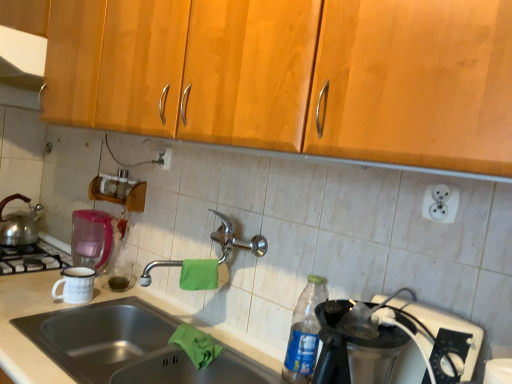
Question: Would you say stainless steel sink at lower left is a long distance from green cloth at sink, the first material positioned from the bottom?

Choices:
 (A) yes
 (B) no

Answer: (B)

Question: Is stainless steel sink at lower left positioned behind green cloth at sink, the first material positioned from the bottom?

Choices:
 (A) no
 (B) yes

Answer: (A)

Question: From the image's perspective, is stainless steel sink at lower left above green cloth at sink, the first material positioned from the bottom?

Choices:
 (A) no
 (B) yes

Answer: (A)

Question: Considering the relative sizes of stainless steel sink at lower left and green cloth at sink, the first material positioned from the bottom, in the image provided, is stainless steel sink at lower left shorter than green cloth at sink, the first material positioned from the bottom,?

Choices:
 (A) yes
 (B) no

Answer: (B)

Question: From a real-world perspective, is stainless steel sink at lower left physically below green cloth at sink, which ranks as the second material in top-to-bottom order?

Choices:
 (A) yes
 (B) no

Answer: (A)

Question: Is stainless steel sink at lower left positioned before green cloth at sink, which ranks as the second material in top-to-bottom order?

Choices:
 (A) yes
 (B) no

Answer: (A)

Question: Is green cloth at center, acting as the 1th material starting from the top, oriented towards shiny silver tea pot at left?

Choices:
 (A) yes
 (B) no

Answer: (B)

Question: From a real-world perspective, is green cloth at center, acting as the 2th material starting from the bottom, located higher than shiny silver tea pot at left?

Choices:
 (A) no
 (B) yes

Answer: (B)

Question: Is green cloth at center, acting as the 1th material starting from the top, positioned in front of shiny silver tea pot at left?

Choices:
 (A) no
 (B) yes

Answer: (B)

Question: Is green cloth at center, acting as the 2th material starting from the bottom, at the right side of shiny silver tea pot at left?

Choices:
 (A) no
 (B) yes

Answer: (B)

Question: Is the depth of green cloth at center, acting as the 2th material starting from the bottom, greater than that of shiny silver tea pot at left?

Choices:
 (A) no
 (B) yes

Answer: (A)

Question: Considering the relative sizes of green cloth at center, acting as the 2th material starting from the bottom, and shiny silver tea pot at left in the image provided, is green cloth at center, acting as the 2th material starting from the bottom, wider than shiny silver tea pot at left?

Choices:
 (A) yes
 (B) no

Answer: (B)

Question: Considering the relative sizes of white plastic outlet at upper right, which appears as the 2th electric outlet when viewed from the left, and white enamel mug at left in the image provided, is white plastic outlet at upper right, which appears as the 2th electric outlet when viewed from the left, thinner than white enamel mug at left?

Choices:
 (A) no
 (B) yes

Answer: (B)